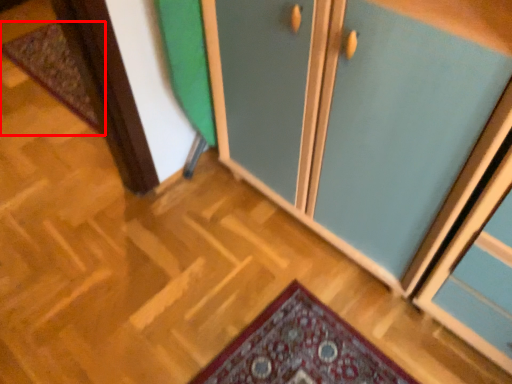
Question: From the image's perspective, what is the correct spatial positioning of mat (annotated by the red box) in reference to cupboard?

Choices:
 (A) below
 (B) above

Answer: (B)